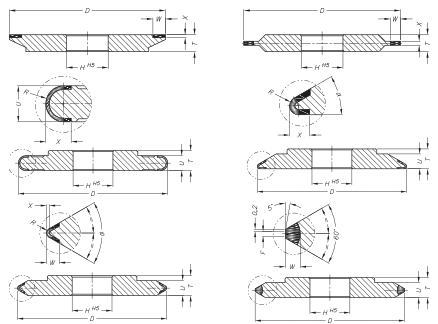
Locate an element on the screen. This screenshot has height=324, width=438. corners is located at coordinates (11, 305), (432, 304), (424, 11), (4, 8).